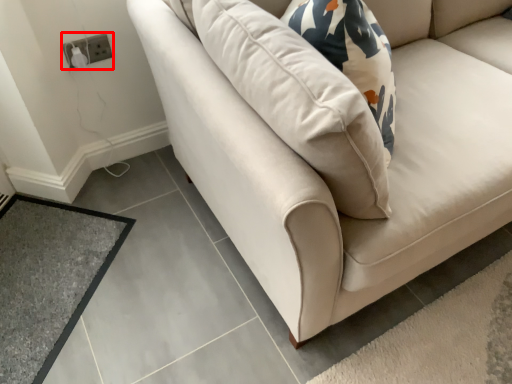
Question: From the image's perspective, what is the correct spatial relationship of electric outlet (annotated by the red box) in relation to mat?

Choices:
 (A) above
 (B) below

Answer: (A)